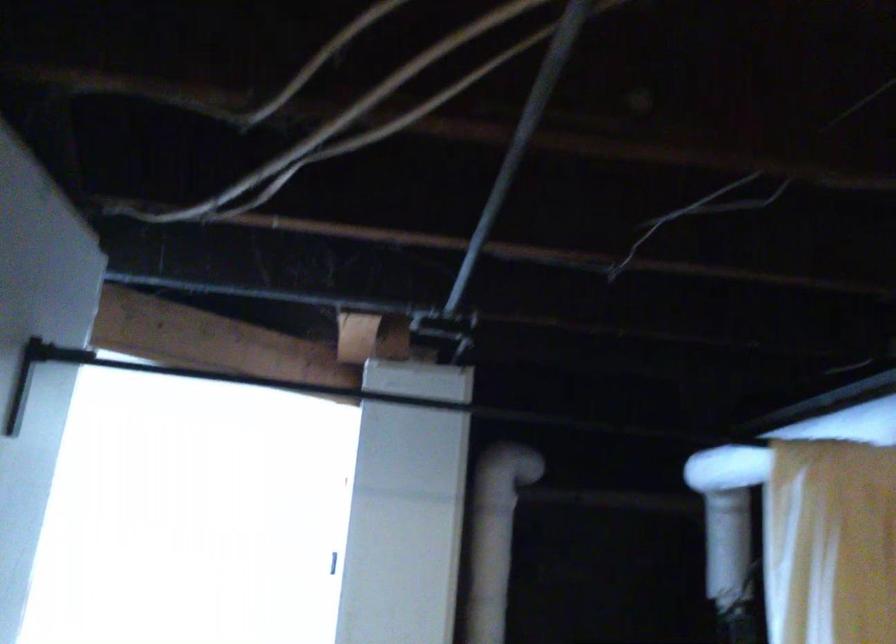
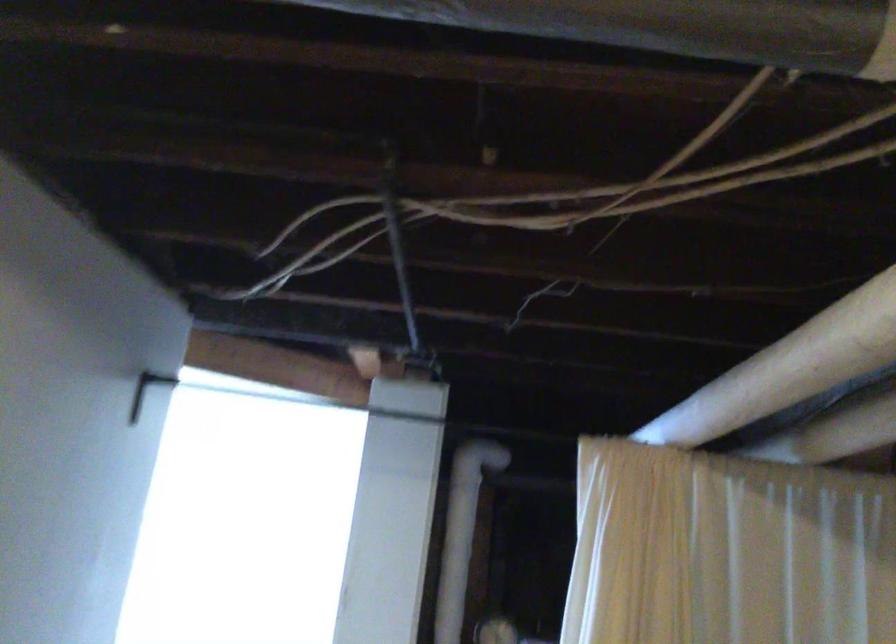
Question: The first image is from the beginning of the video and the second image is from the end. How did the camera likely rotate when shooting the video?

Choices:
 (A) Left
 (B) Right
 (C) Up
 (D) Down

Answer: (A)